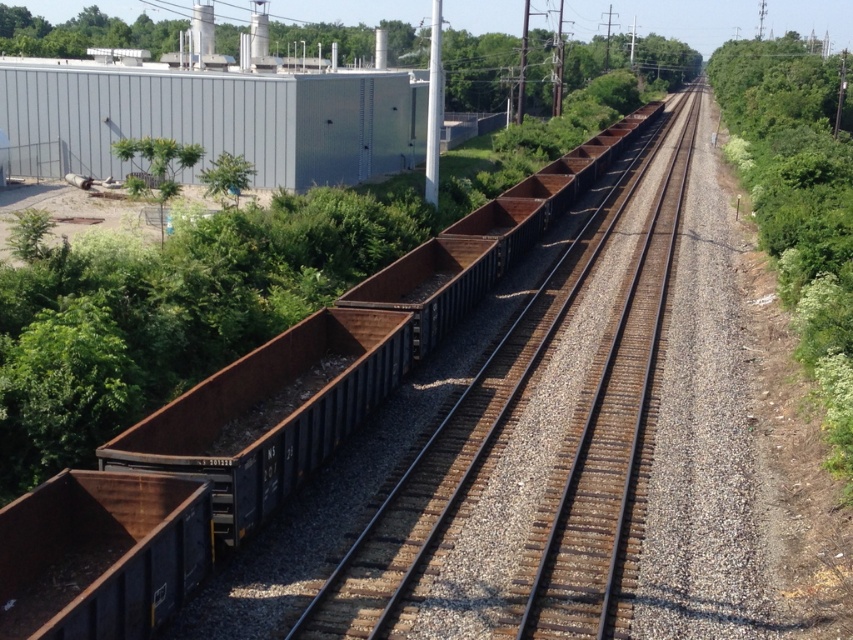
Is rusty metal train car at center bigger than green leafy tree at upper left?

Correct, rusty metal train car at center is larger in size than green leafy tree at upper left.

Which is above, rusty metal train car at center or green leafy tree at upper left?

green leafy tree at upper left

Does point (479, 209) come farther from viewer compared to point (206, 189)?

No, (479, 209) is closer to viewer.

The width and height of the screenshot is (853, 640). In order to click on rusty metal train car at center in this screenshot , I will do `click(251, 429)`.

Is point (651, 330) more distant than point (277, 26)?

No, it is not.

Does point (593, 429) come in front of point (572, 65)?

Yes, point (593, 429) is in front of point (572, 65).

The image size is (853, 640). I want to click on rusty metal train track at center, so click(x=606, y=445).

Who is higher up, rusty metal train car at lower left or green leafy tree at upper center?

green leafy tree at upper center is higher up.

Does point (20, 540) lie behind point (421, 65)?

No.

Describe the element at coordinates (99, 554) in the screenshot. I see `rusty metal train car at lower left` at that location.

Identify the location of rusty metal train car at lower left. The width and height of the screenshot is (853, 640). (99, 554).